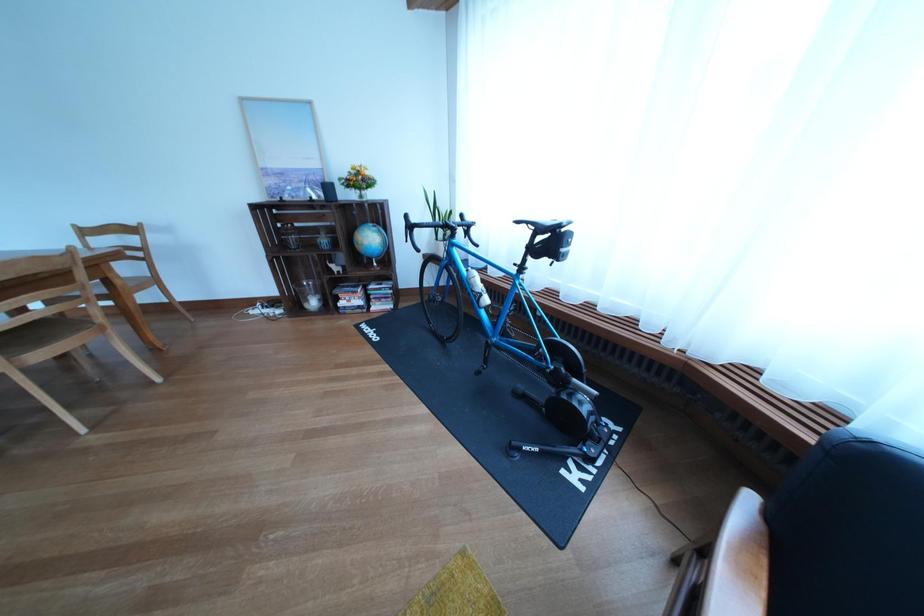
The image size is (924, 616). Identify the location of bicycle handlebars. (410, 231).